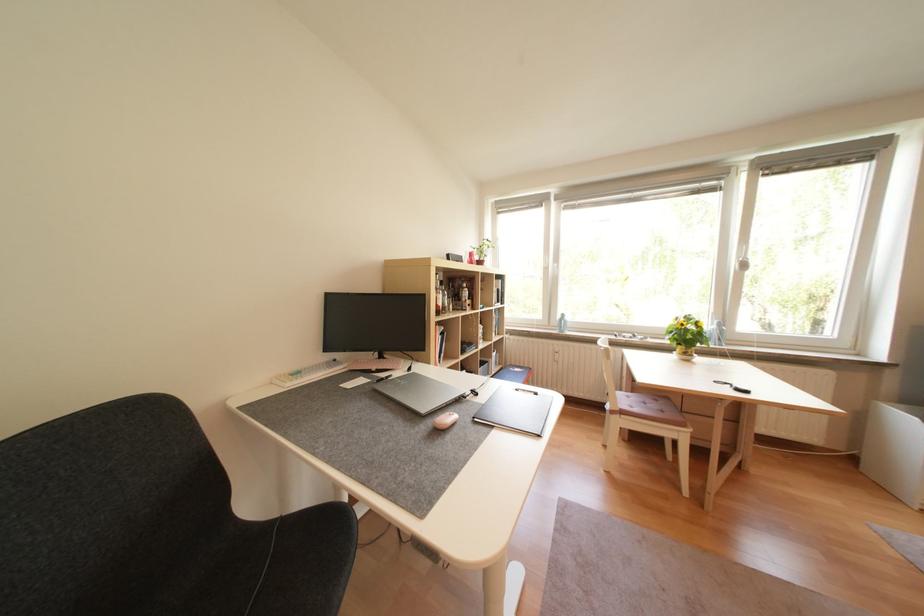
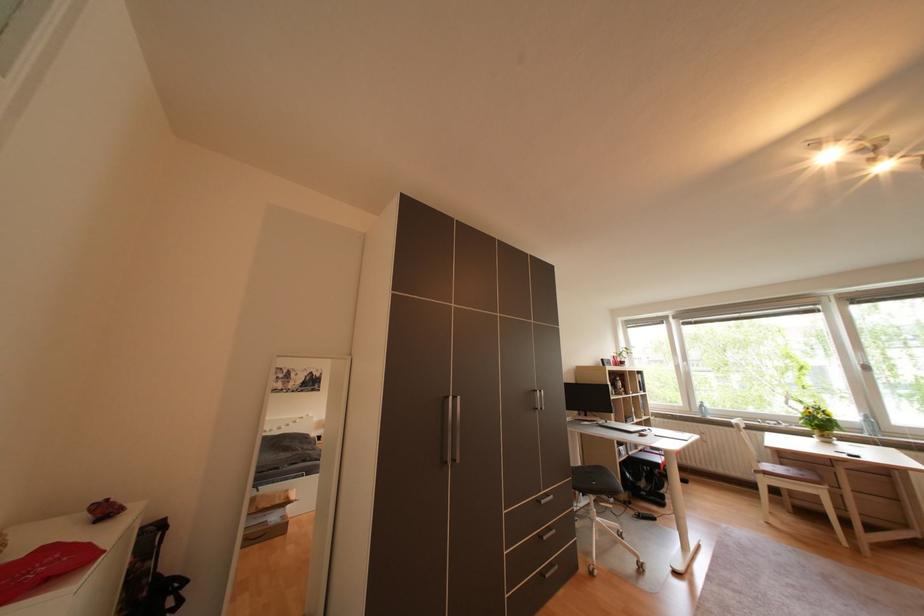
Question: Which direction would the cameraman need to move to produce the second image? Reply with the corresponding letter.

Choices:
 (A) Left
 (B) Right
 (C) Forward
 (D) Backward

Answer: (D)